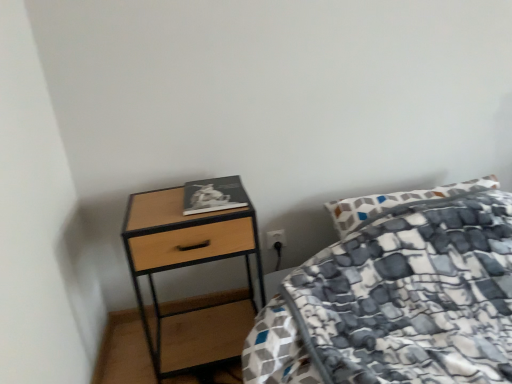
Identify the location of free space above matte black book at upper left (from a real-world perspective). (210, 188).